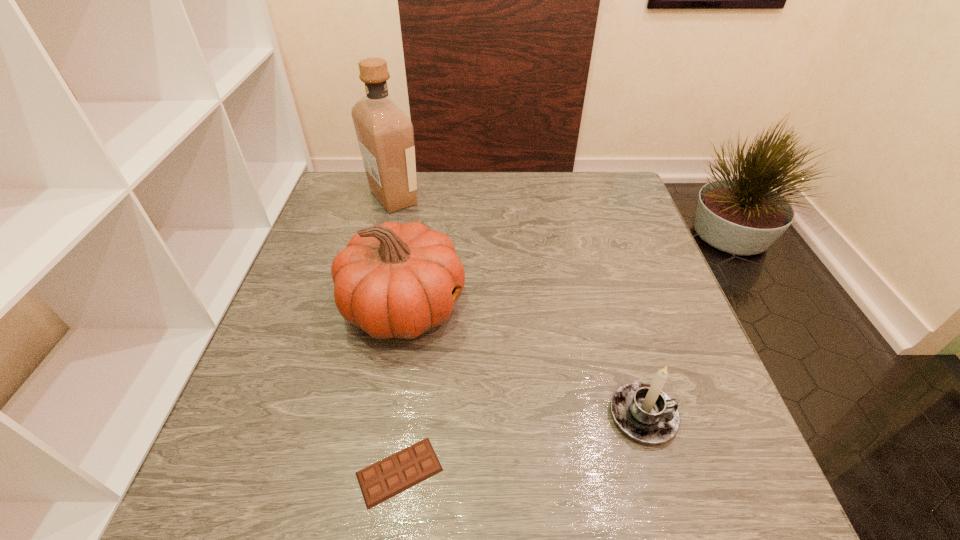
This screenshot has height=540, width=960. I want to click on vacant space located 0.210m on the back of the shortest object, so click(417, 342).

Locate an element on the screen. object that is at the far edge is located at coordinates (385, 134).

Where is `object located at the near edge`? object located at the near edge is located at coordinates (396, 473).

The height and width of the screenshot is (540, 960). I want to click on liquor located in the left edge section of the desktop, so click(x=385, y=134).

Identify the location of pumpkin present at the left edge. (x=393, y=280).

Where is `object that is at the right edge`? This screenshot has width=960, height=540. object that is at the right edge is located at coordinates (644, 412).

The image size is (960, 540). I want to click on object at the far left corner, so click(385, 134).

Identify the location of vacant space at the far edge of the desktop. (487, 208).

You are a GUI agent. You are given a task and a screenshot of the screen. Output one action in this format:
    pyautogui.click(x=<x>, y=<y>)
    Task: Click on the free space at the near edge
    The image size is (960, 540).
    Given the screenshot: What is the action you would take?
    [323, 508]

What are the coordinates of `vacant space at the left edge` in the screenshot? It's located at (364, 219).